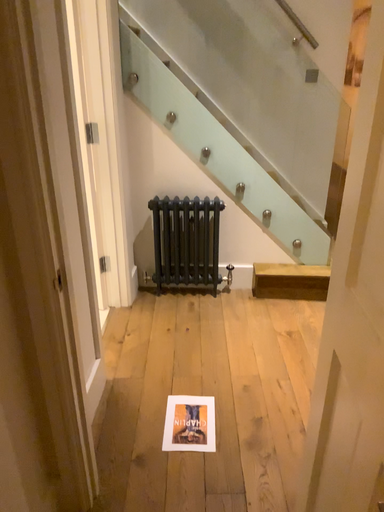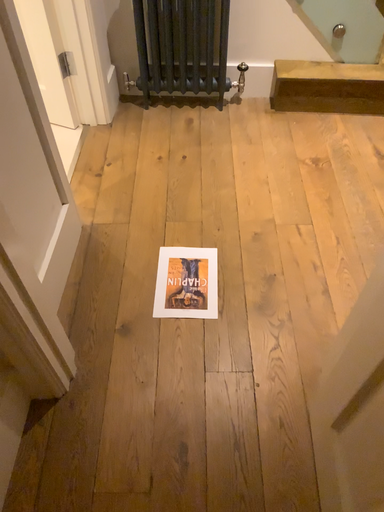
Question: Which way did the camera rotate in the video?

Choices:
 (A) rotated downward
 (B) rotated upward

Answer: (A)